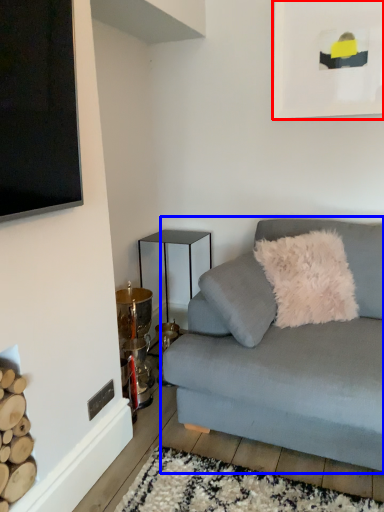
Question: Which object is closer to the camera taking this photo, picture frame (highlighted by a red box) or studio couch (highlighted by a blue box)?

Choices:
 (A) picture frame
 (B) studio couch

Answer: (B)